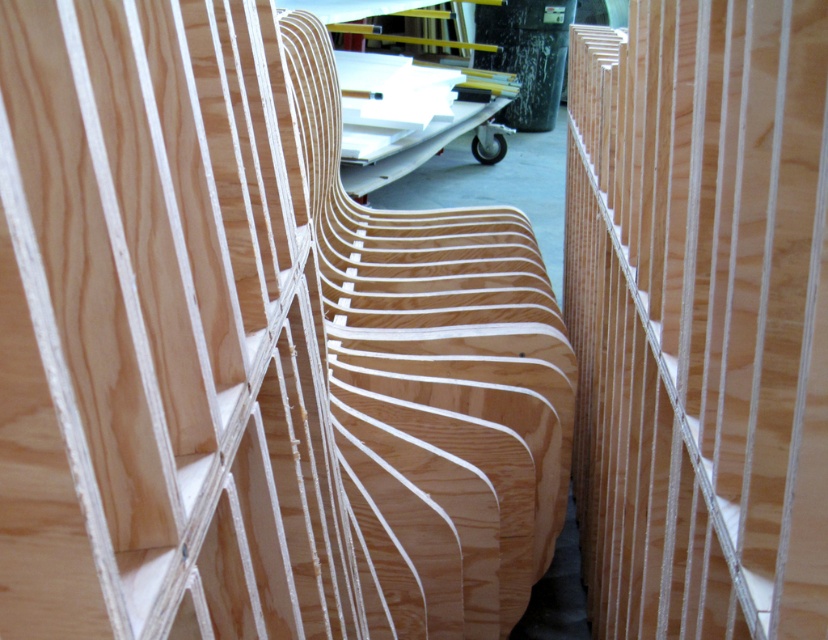
Question: Where is natural wood chair at center located in relation to natural wood plywood at center in the image?

Choices:
 (A) left
 (B) right

Answer: (A)

Question: Which point is farther to the camera?

Choices:
 (A) (694, 237)
 (B) (424, 424)

Answer: (B)

Question: Is natural wood chair at center above natural wood plywood at center?

Choices:
 (A) no
 (B) yes

Answer: (A)

Question: Which object is farther from the camera taking this photo?

Choices:
 (A) natural wood plywood at center
 (B) natural wood chair at center

Answer: (A)

Question: Can you confirm if natural wood chair at center is thinner than natural wood plywood at center?

Choices:
 (A) yes
 (B) no

Answer: (B)